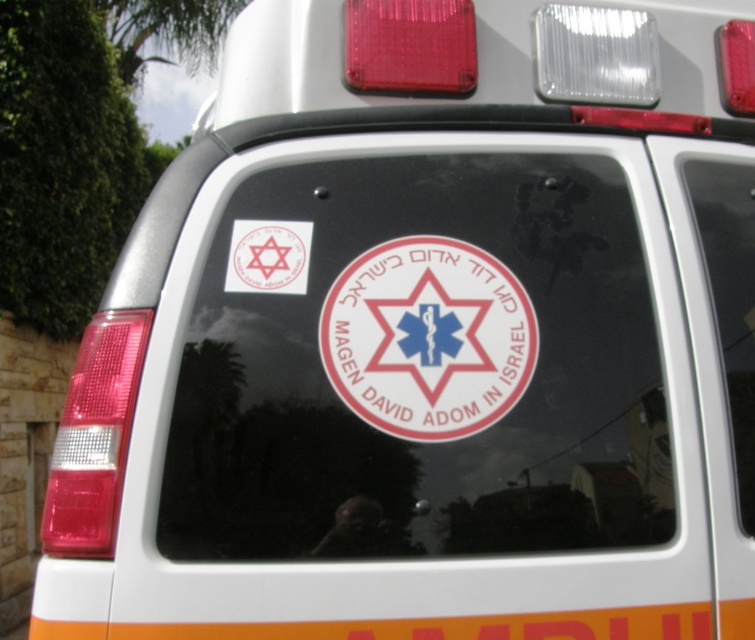
Question: Which point is closer to the camera?

Choices:
 (A) (290, 284)
 (B) (455, 344)

Answer: (A)

Question: Can you confirm if white sticker at center is smaller than matte white sticker at upper left?

Choices:
 (A) no
 (B) yes

Answer: (A)

Question: Does white sticker at center appear on the right side of matte white sticker at upper left?

Choices:
 (A) yes
 (B) no

Answer: (A)

Question: Can you confirm if white sticker at center is positioned to the left of matte white sticker at upper left?

Choices:
 (A) no
 (B) yes

Answer: (A)